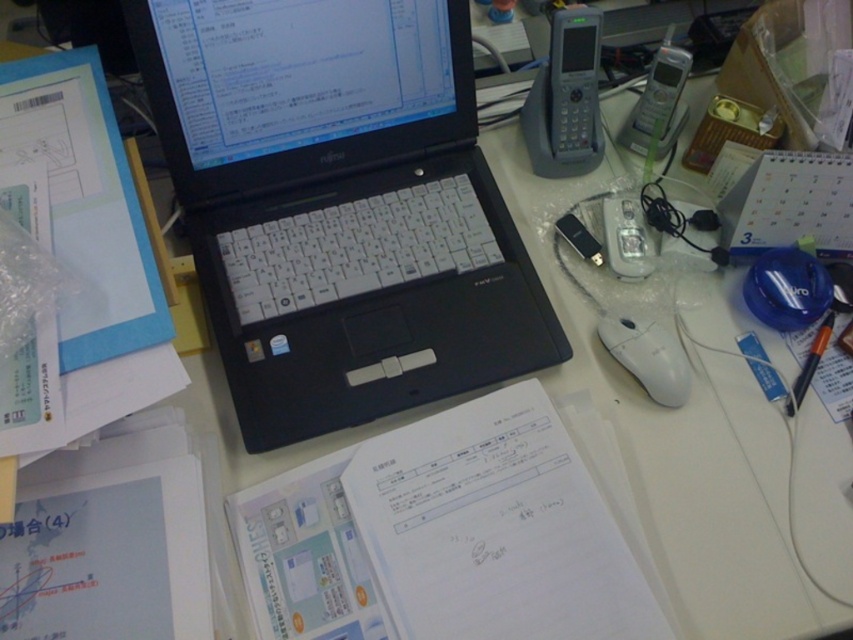
Question: Can you confirm if black matte laptop at center is positioned above white matte mouse at center-right?

Choices:
 (A) yes
 (B) no

Answer: (A)

Question: Which of the following is the farthest from the observer?

Choices:
 (A) coord(248,440)
 (B) coord(625,339)

Answer: (B)

Question: From the image, what is the correct spatial relationship of black matte laptop at center in relation to white matte mouse at center-right?

Choices:
 (A) below
 (B) above

Answer: (B)

Question: Which object is farther from the camera taking this photo?

Choices:
 (A) black matte laptop at center
 (B) white matte mouse at center-right

Answer: (B)

Question: Among these points, which one is farthest from the camera?

Choices:
 (A) (454, 38)
 (B) (602, 314)

Answer: (B)

Question: Does black matte laptop at center come in front of white matte mouse at center-right?

Choices:
 (A) yes
 (B) no

Answer: (A)